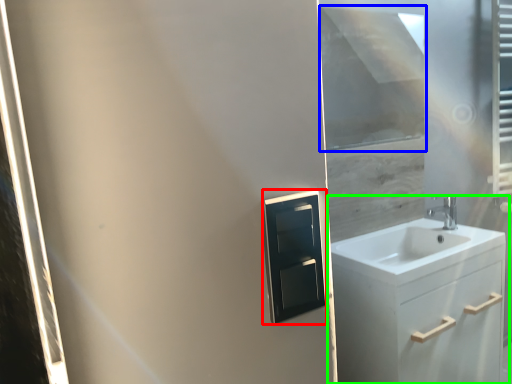
Question: Based on their relative distances, which object is nearer to medicine cabinet (highlighted by a red box)? Choose from window screen (highlighted by a blue box) and bathroom cabinet (highlighted by a green box).

Choices:
 (A) window screen
 (B) bathroom cabinet

Answer: (B)